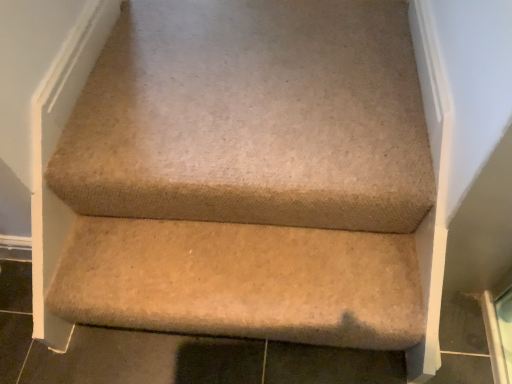
Find the location of a particular element. The height and width of the screenshot is (384, 512). beige carpeted stairs at center is located at coordinates (248, 174).

This screenshot has width=512, height=384. What do you see at coordinates (248, 174) in the screenshot?
I see `beige carpeted stairs at center` at bounding box center [248, 174].

This screenshot has height=384, width=512. In order to click on beige carpeted stair at lower center in this screenshot , I will do `click(242, 282)`.

Describe the element at coordinates (242, 282) in the screenshot. The width and height of the screenshot is (512, 384). I see `beige carpeted stair at lower center` at that location.

The image size is (512, 384). I want to click on beige carpeted stairs at center, so click(248, 174).

Can you confirm if beige carpeted stair at lower center is positioned to the left of beige carpeted stairs at center?

Yes, beige carpeted stair at lower center is to the left of beige carpeted stairs at center.

Is beige carpeted stair at lower center further to the viewer compared to beige carpeted stairs at center?

That is True.

Between point (383, 270) and point (165, 211), which one is positioned behind?

The point (165, 211) is more distant.

From the image's perspective, which one is positioned higher, beige carpeted stair at lower center or beige carpeted stairs at center?

beige carpeted stairs at center.

From a real-world perspective, who is located lower, beige carpeted stair at lower center or beige carpeted stairs at center?

beige carpeted stair at lower center is physically lower.

Between beige carpeted stair at lower center and beige carpeted stairs at center, which one has smaller width?

Thinner between the two is beige carpeted stair at lower center.

Does beige carpeted stair at lower center have a greater height compared to beige carpeted stairs at center?

Yes.

Which of these two, beige carpeted stair at lower center or beige carpeted stairs at center, is bigger?

With larger size is beige carpeted stair at lower center.

Does beige carpeted stair at lower center contain beige carpeted stairs at center?

No, beige carpeted stairs at center is located outside of beige carpeted stair at lower center.

Is beige carpeted stair at lower center in contact with beige carpeted stairs at center?

There is a gap between beige carpeted stair at lower center and beige carpeted stairs at center.

Could you tell me if beige carpeted stair at lower center is facing beige carpeted stairs at center?

No, beige carpeted stair at lower center is not turned towards beige carpeted stairs at center.

How many degrees apart are the facing directions of beige carpeted stair at lower center and beige carpeted stairs at center?

There is a 0.00149-degree angle between the facing directions of beige carpeted stair at lower center and beige carpeted stairs at center.

This screenshot has height=384, width=512. What are the coordinates of `stairwell lying on the left of beige carpeted stairs at center` in the screenshot? It's located at (242, 282).

Does beige carpeted stairs at center appear on the left side of beige carpeted stair at lower center?

No, beige carpeted stairs at center is not to the left of beige carpeted stair at lower center.

Which is in front, beige carpeted stairs at center or beige carpeted stair at lower center?

beige carpeted stairs at center is more forward.

Considering the positions of point (178, 19) and point (110, 283), is point (178, 19) closer or farther from the camera than point (110, 283)?

Point (178, 19) is farther from the camera than point (110, 283).

From the image's perspective, would you say beige carpeted stairs at center is shown under beige carpeted stair at lower center?

Incorrect, from the image's perspective, beige carpeted stairs at center is higher than beige carpeted stair at lower center.

From a real-world perspective, which is physically below, beige carpeted stairs at center or beige carpeted stair at lower center?

From a 3D spatial view, beige carpeted stair at lower center is below.

Looking at their sizes, would you say beige carpeted stairs at center is wider or thinner than beige carpeted stair at lower center?

beige carpeted stairs at center is wider than beige carpeted stair at lower center.

Which of these two, beige carpeted stairs at center or beige carpeted stair at lower center, stands shorter?

beige carpeted stairs at center.

Does beige carpeted stairs at center have a larger size compared to beige carpeted stair at lower center?

Actually, beige carpeted stairs at center might be smaller than beige carpeted stair at lower center.

Is beige carpeted stair at lower center located within beige carpeted stairs at center?

No, beige carpeted stair at lower center is located outside of beige carpeted stairs at center.

Is beige carpeted stairs at center far away from beige carpeted stair at lower center?

beige carpeted stairs at center is actually quite close to beige carpeted stair at lower center.

Is beige carpeted stair at lower center at the back of beige carpeted stairs at center?

No, beige carpeted stairs at center is not facing the opposite direction of beige carpeted stair at lower center.

How distant is beige carpeted stairs at center from beige carpeted stair at lower center?

beige carpeted stairs at center is 6.05 inches away from beige carpeted stair at lower center.

Where is `stairwell on the left of beige carpeted stairs at center`? The height and width of the screenshot is (384, 512). stairwell on the left of beige carpeted stairs at center is located at coordinates (242, 282).

Find the location of a particular element. furniture on the right of beige carpeted stair at lower center is located at coordinates (248, 174).

The height and width of the screenshot is (384, 512). I want to click on stairwell located on the left of beige carpeted stairs at center, so click(x=242, y=282).